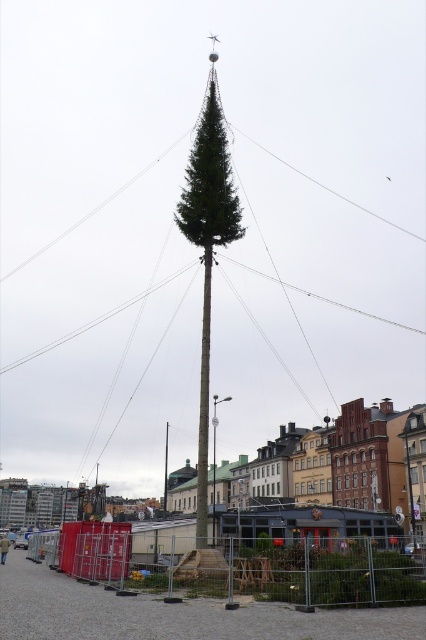
Consider the image. You are standing in the urban area looking at the tall tree structure. There are two points marked on the ground in front of you. The first point is at coordinates point (215,136) and the second is at point (166,426). If you want to place a small bench between them, which point should you start from to ensure the bench is closer to the tree structure?

You should start from point (215,136) because it is closer to the camera and thus closer to the tree structure than point (166,426).

You are standing at the point marked by the coordinates point (x=207, y=246) in the image. What object are you directly facing?

The point (x=207, y=246) indicates green matte tree at center, so you are directly facing the green matte tree at center.

You are standing in an urban park and see both the green matte tree at center and the green matte pole at center. If you want to walk to the one that is closer to you, which one should you head towards?

Both the green matte tree at center and the green matte pole at center are at the same distance from you since they are both located at the center of the image.